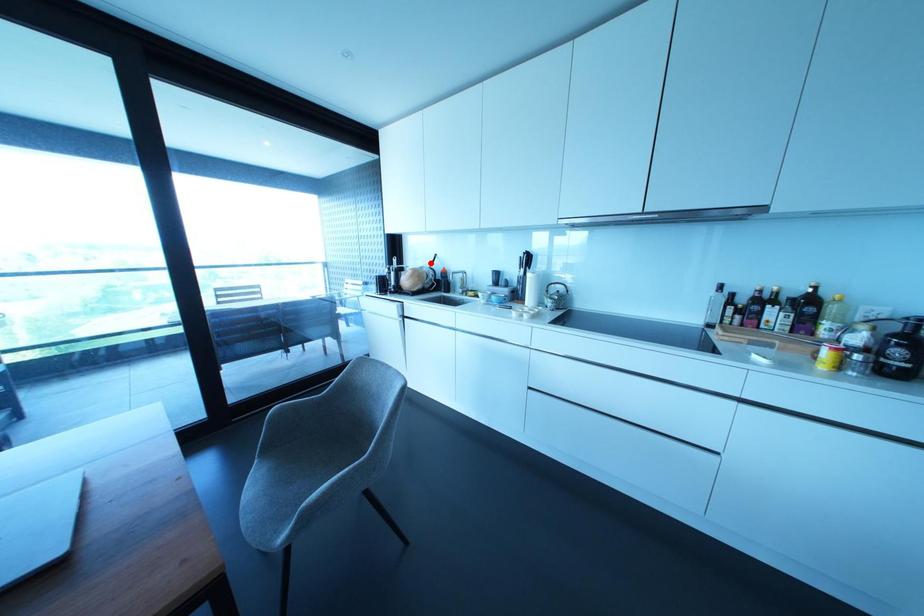
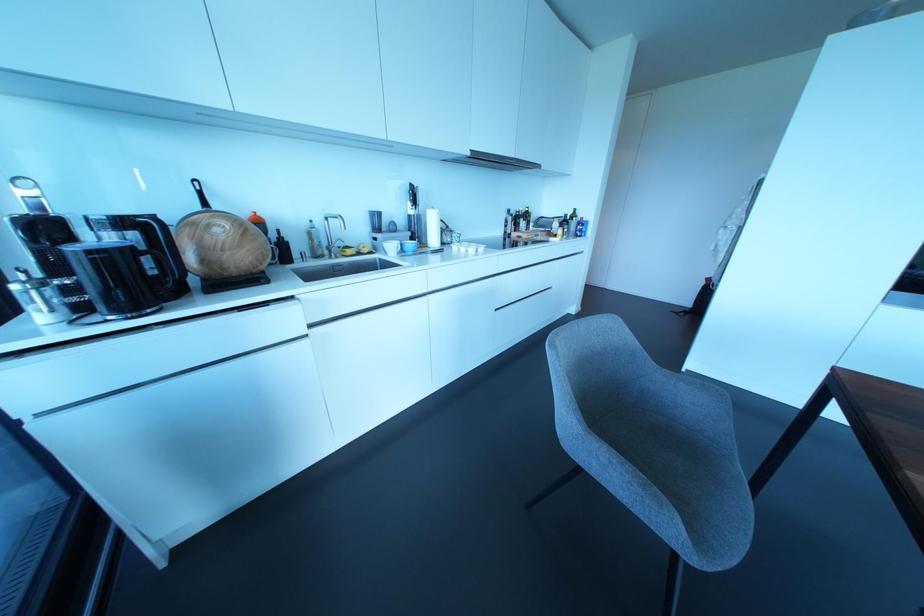
Find the pixel in the second image that matches the highlighted location in the first image.

(204, 204)